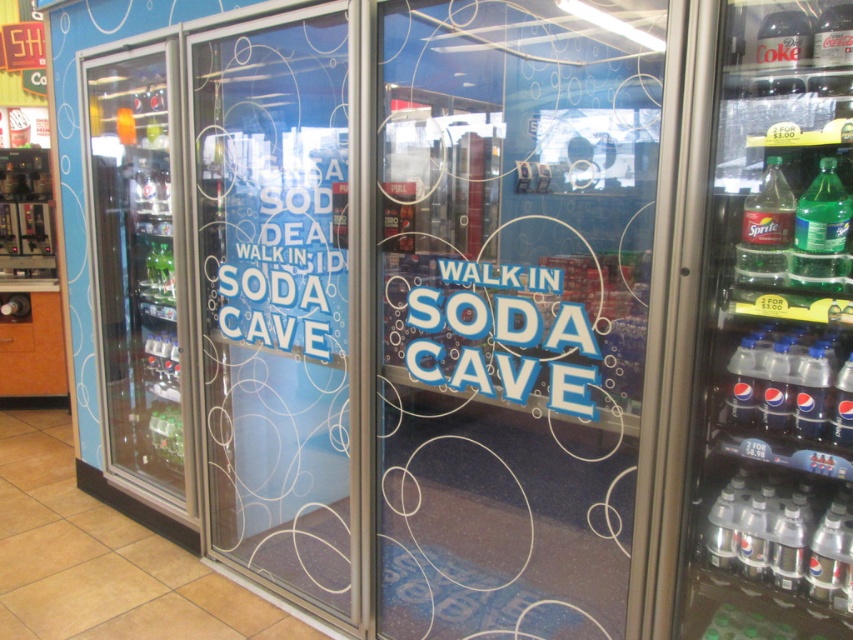
Question: Estimate the real-world distances between objects in this image. Which object is farther from the clear plastic bottle at lower right?

Choices:
 (A) transparent plastic door at center
 (B) clear plastic bottles at center right

Answer: (A)

Question: Can you confirm if blue frosted glass door at center is positioned above translucent plastic bottle at right?

Choices:
 (A) no
 (B) yes

Answer: (A)

Question: Among these points, which one is nearest to the camera?

Choices:
 (A) (273, 561)
 (B) (496, 308)

Answer: (B)

Question: Can you confirm if transparent plastic door at center is smaller than translucent plastic bottle at right?

Choices:
 (A) no
 (B) yes

Answer: (A)

Question: Can you confirm if transparent plastic door at center is thinner than clear glass refrigerator at left?

Choices:
 (A) no
 (B) yes

Answer: (A)

Question: Which object is closer to the camera taking this photo?

Choices:
 (A) clear plastic bottles at center right
 (B) clear plastic bottle at lower right

Answer: (A)